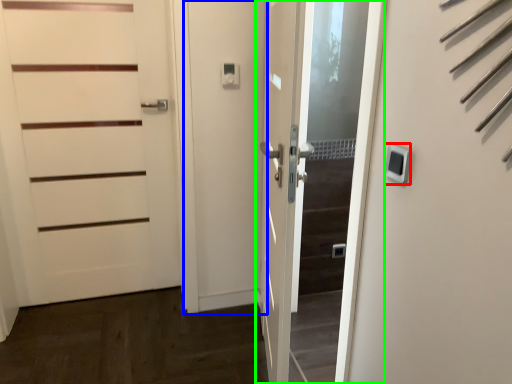
Question: Which object is positioned farthest from thermostat (highlighted by a red box)? Select from screen door (highlighted by a blue box) and door (highlighted by a green box).

Choices:
 (A) screen door
 (B) door

Answer: (A)